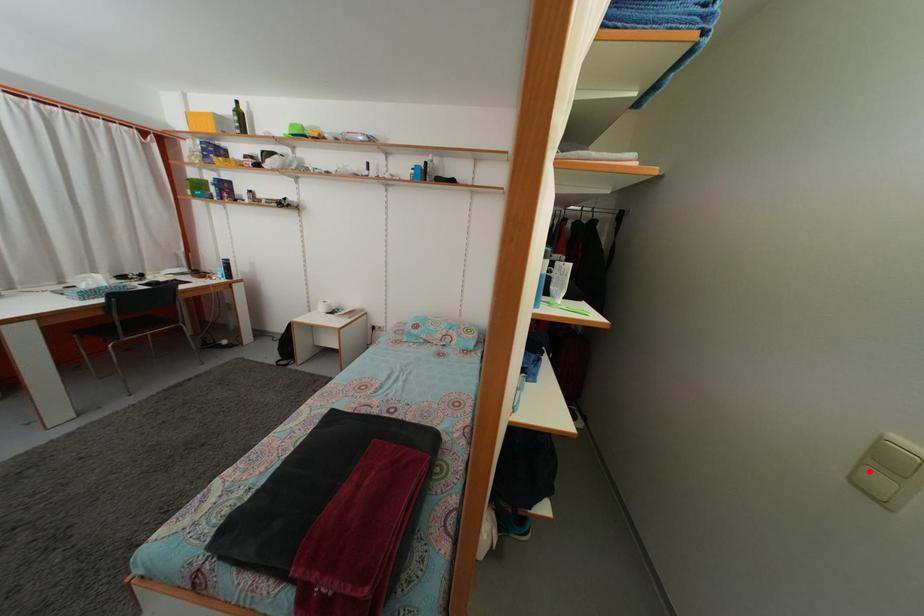
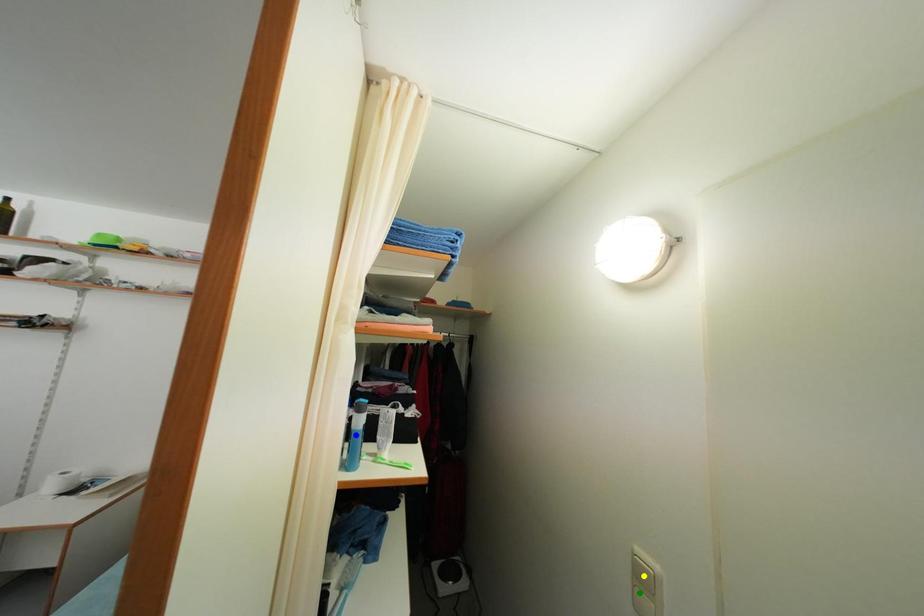
Question: I am providing you with two images of the same scene from different viewpoints. A red point is marked on the first image. You are given multiple points on the second image. Which point in image 2 is actually the same real-world point as the red point in image 1?

Choices:
 (A) green point
 (B) blue point
 (C) yellow point

Answer: (A)